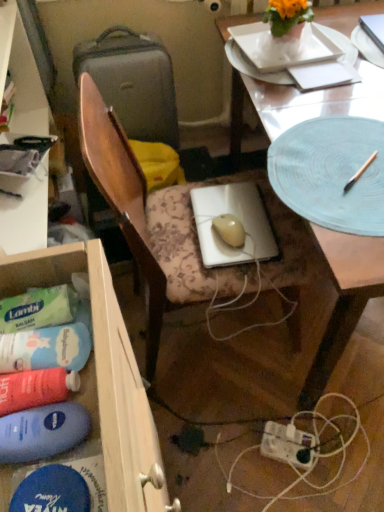
Locate an element on the screen. The width and height of the screenshot is (384, 512). vacant area that lies between light blue textured platter at upper right and white paper at upper right is located at coordinates (316, 98).